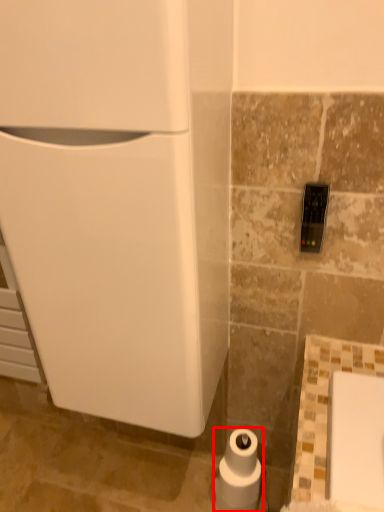
Question: From the image's perspective, where is toilet paper (annotated by the red box) located in relation to appliance in the image?

Choices:
 (A) below
 (B) above

Answer: (A)